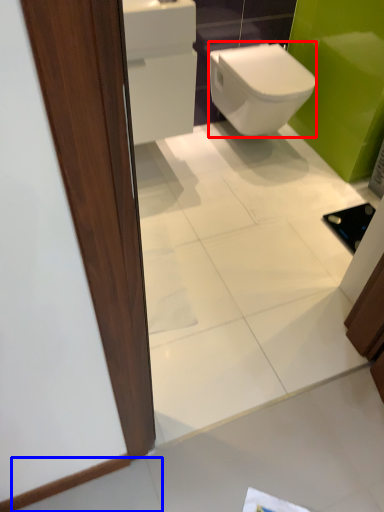
Question: Which point is closer to the camera, bidet (highlighted by a red box) or tile (highlighted by a blue box)?

Choices:
 (A) bidet
 (B) tile

Answer: (B)